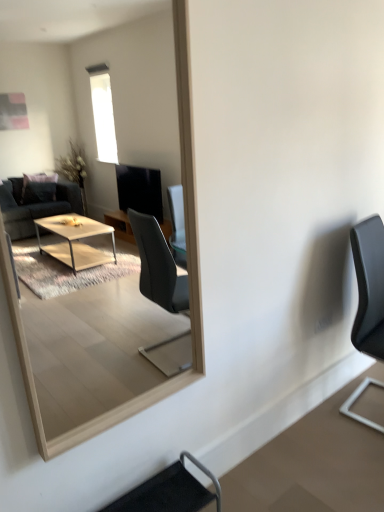
Identify the location of black leather chair at lower center, the second chair positioned from the right. (170, 490).

Find the location of a particular element. black leather chair at lower center, the second chair from the back is located at coordinates (170, 490).

Considering the positions of points (170, 497) and (43, 145), is point (170, 497) farther from camera compared to point (43, 145)?

No, it is in front of (43, 145).

You are a GUI agent. You are given a task and a screenshot of the screen. Output one action in this format:
    pyautogui.click(x=<x>, y=<y>)
    Task: Click on the mirror located above the black leather chair at lower center, the 1th chair when ordered from left to right (from the image's perspective)
    This screenshot has width=384, height=512.
    Given the screenshot: What is the action you would take?
    pyautogui.click(x=90, y=104)

Considering the sizes of black leather chair at lower center, acting as the 1th chair starting from the bottom, and wooden frame mirror at center in the image, is black leather chair at lower center, acting as the 1th chair starting from the bottom, wider or thinner than wooden frame mirror at center?

In the image, black leather chair at lower center, acting as the 1th chair starting from the bottom, appears to be wider than wooden frame mirror at center.

Is black leather chair at lower center, acting as the 1th chair starting from the bottom, not within wooden frame mirror at center?

Absolutely, black leather chair at lower center, acting as the 1th chair starting from the bottom, is external to wooden frame mirror at center.

From the image's perspective, is wooden frame mirror at center located above or below black leather chair at lower center, the second chair from the back?

Clearly, from the image's perspective, wooden frame mirror at center is above black leather chair at lower center, the second chair from the back.

Locate an element on the screen. The width and height of the screenshot is (384, 512). chair that is the 1st object to the right of the wooden frame mirror at center, starting at the anchor is located at coordinates (170, 490).

Which is correct: wooden frame mirror at center is inside black leather chair at lower center, placed as the second chair when sorted from top to bottom, or outside of it?

The correct answer is: outside.

How far apart are wooden frame mirror at center and black leather chair at lower center, placed as the second chair when sorted from top to bottom?

wooden frame mirror at center and black leather chair at lower center, placed as the second chair when sorted from top to bottom, are 1.97 meters apart.

Does point (366, 311) come farther from viewer compared to point (187, 452)?

That is True.

Could you tell me if black matte chair at right, the 2th chair positioned from the bottom, is facing black leather chair at lower center, acting as the 1th chair starting from the bottom?

No, black matte chair at right, the 2th chair positioned from the bottom, is not oriented towards black leather chair at lower center, acting as the 1th chair starting from the bottom.

Considering the sizes of black matte chair at right, the 2th chair positioned from the bottom, and black leather chair at lower center, marked as the 1th chair in a front-to-back arrangement, in the image, is black matte chair at right, the 2th chair positioned from the bottom, taller or shorter than black leather chair at lower center, marked as the 1th chair in a front-to-back arrangement,?

Clearly, black matte chair at right, the 2th chair positioned from the bottom, is taller compared to black leather chair at lower center, marked as the 1th chair in a front-to-back arrangement.

Based on the photo, what's the angular difference between wooden frame mirror at center and black matte chair at right, which is the first chair from right to left,'s facing directions?

The angle between the facing direction of wooden frame mirror at center and the facing direction of black matte chair at right, which is the first chair from right to left, is 7.3 degrees.

From the image's perspective, is wooden frame mirror at center located above or below black matte chair at right, which is the first chair from right to left?

wooden frame mirror at center is situated higher than black matte chair at right, which is the first chair from right to left, in the image.

From the picture: Is wooden frame mirror at center outside of black matte chair at right, arranged as the 2th chair when viewed from the front?

Yes.

Is wooden frame mirror at center aimed at black matte chair at right, which is the first chair from right to left?

No, wooden frame mirror at center is not turned towards black matte chair at right, which is the first chair from right to left.

Does point (359, 247) appear closer or farther from the camera than point (62, 91)?

Point (359, 247).

Is black matte chair at right, which is the first chair from right to left, next to wooden frame mirror at center and touching it?

No, black matte chair at right, which is the first chair from right to left, is not beside wooden frame mirror at center.

From a real-world perspective, is black matte chair at right, arranged as the 2th chair when viewed from the front, below wooden frame mirror at center?

Indeed, from a real-world perspective, black matte chair at right, arranged as the 2th chair when viewed from the front, is positioned beneath wooden frame mirror at center.

Is black matte chair at right, arranged as the 2th chair when viewed from the front, bigger than wooden frame mirror at center?

Yes, black matte chair at right, arranged as the 2th chair when viewed from the front, is bigger than wooden frame mirror at center.

Where is `chair lying on the right of black leather chair at lower center, the 1th chair when ordered from left to right`? The image size is (384, 512). chair lying on the right of black leather chair at lower center, the 1th chair when ordered from left to right is located at coordinates (369, 286).

How much distance is there between black leather chair at lower center, placed as the second chair when sorted from top to bottom, and black matte chair at right, arranged as the 2th chair when viewed from the front?

The distance of black leather chair at lower center, placed as the second chair when sorted from top to bottom, from black matte chair at right, arranged as the 2th chair when viewed from the front, is 3.75 feet.

Considering the positions of objects black leather chair at lower center, acting as the 1th chair starting from the bottom, and black matte chair at right, positioned as the 1th chair in top-to-bottom order, in the image provided, who is more to the left, black leather chair at lower center, acting as the 1th chair starting from the bottom, or black matte chair at right, positioned as the 1th chair in top-to-bottom order,?

black leather chair at lower center, acting as the 1th chair starting from the bottom, is more to the left.

The image size is (384, 512). Find the location of `the 2nd chair below when counting from the wooden frame mirror at center (from the image's perspective)`. the 2nd chair below when counting from the wooden frame mirror at center (from the image's perspective) is located at coordinates (170, 490).

Where is `chair that is the 1st object located behind the wooden frame mirror at center`? Image resolution: width=384 pixels, height=512 pixels. chair that is the 1st object located behind the wooden frame mirror at center is located at coordinates (170, 490).

Which object lies further to the anchor point black matte chair at right, the 2th chair positioned from the bottom, black leather chair at lower center, the 1th chair when ordered from left to right, or wooden frame mirror at center?

Among the two, wooden frame mirror at center is located further to black matte chair at right, the 2th chair positioned from the bottom.

From the image, which object appears to be nearer to wooden frame mirror at center, black leather chair at lower center, marked as the 1th chair in a front-to-back arrangement, or black matte chair at right, which is the first chair from right to left?

black leather chair at lower center, marked as the 1th chair in a front-to-back arrangement, lies closer to wooden frame mirror at center than the other object.

From the picture: From the image, which object appears to be nearer to black leather chair at lower center, placed as the second chair when sorted from top to bottom, black matte chair at right, arranged as the 2th chair when viewed from the front, or wooden frame mirror at center?

The object closer to black leather chair at lower center, placed as the second chair when sorted from top to bottom, is black matte chair at right, arranged as the 2th chair when viewed from the front.

Which object lies further to the anchor point wooden frame mirror at center, black matte chair at right, positioned as the 1th chair in top-to-bottom order, or black leather chair at lower center, the second chair from the back?

Among the two, black matte chair at right, positioned as the 1th chair in top-to-bottom order, is located further to wooden frame mirror at center.

Which object lies further to the anchor point black leather chair at lower center, the second chair positioned from the right, wooden frame mirror at center or black matte chair at right, which is the first chair from right to left?

wooden frame mirror at center is positioned further to the anchor black leather chair at lower center, the second chair positioned from the right.

Estimate the real-world distances between objects in this image. Which object is closer to black matte chair at right, acting as the first chair starting from the back, wooden frame mirror at center or black leather chair at lower center, marked as the 1th chair in a front-to-back arrangement?

The object closer to black matte chair at right, acting as the first chair starting from the back, is black leather chair at lower center, marked as the 1th chair in a front-to-back arrangement.

This screenshot has width=384, height=512. What are the coordinates of `chair between wooden frame mirror at center and black matte chair at right, acting as the first chair starting from the back, from left to right` in the screenshot? It's located at (170, 490).